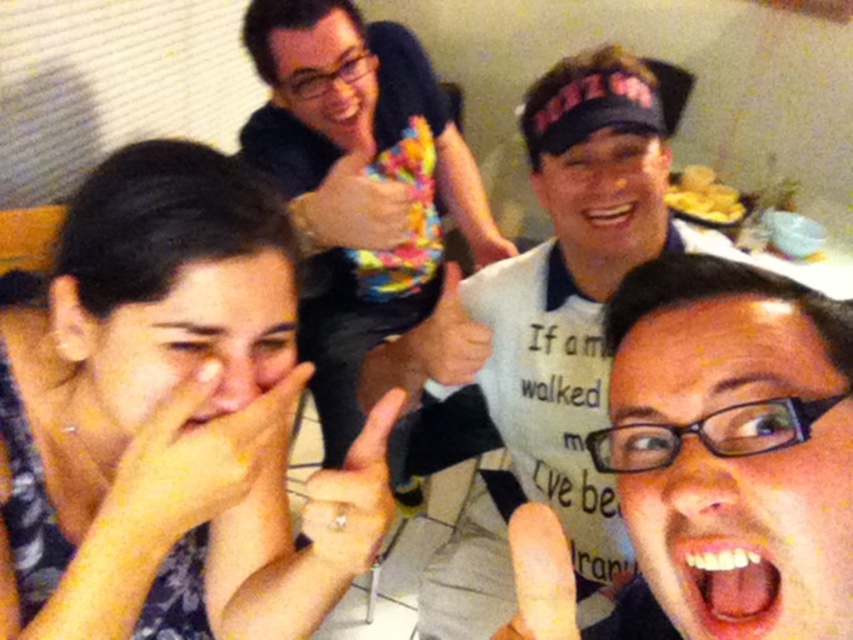
Question: Which of the following is the farthest from the observer?

Choices:
 (A) (277, 122)
 (B) (474, 276)
 (C) (10, 465)

Answer: (A)

Question: Which of these objects is positioned closest to the floral fabric face at lower left?

Choices:
 (A) white cotton shirt at center
 (B) multicolored plush toy at upper center

Answer: (A)

Question: Which is nearer to the floral fabric face at lower left?

Choices:
 (A) white cotton shirt at center
 (B) multicolored plush toy at upper center

Answer: (A)

Question: Can you confirm if white cotton shirt at center is positioned to the left of multicolored plush toy at upper center?

Choices:
 (A) no
 (B) yes

Answer: (A)

Question: Does white cotton shirt at center have a larger size compared to multicolored plush toy at upper center?

Choices:
 (A) yes
 (B) no

Answer: (B)

Question: Can you confirm if floral fabric face at lower left is wider than multicolored plush toy at upper center?

Choices:
 (A) no
 (B) yes

Answer: (A)